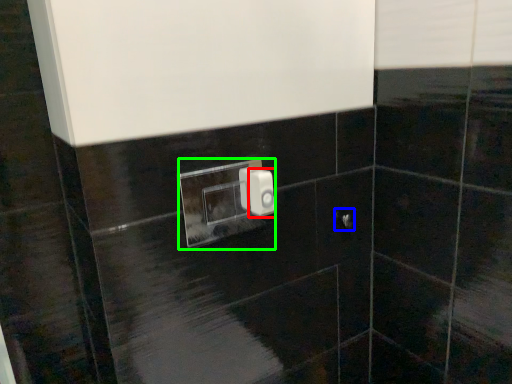
Question: Considering the real-world distances, which object is closest to light switch (highlighted by a red box)? door handle (highlighted by a blue box) or light switch (highlighted by a green box).

Choices:
 (A) door handle
 (B) light switch

Answer: (A)